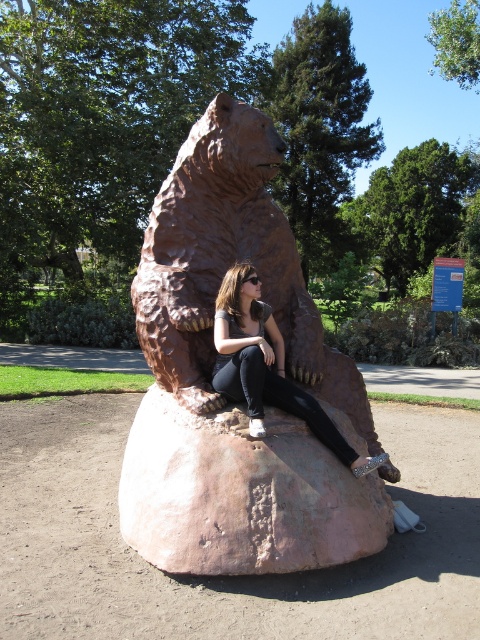
Based on the photo, you are a photographer trying to capture a clear shot of the matte bronze bear at center without the pink stone boulder at center blocking it. Based on their positions, is this possible?

The pink stone boulder at center is in front of the matte bronze bear at center, so it is blocking the view. To capture a clear shot of the matte bronze bear at center without the boulder, you would need to move around to a different angle where the boulder is not in front.

Consider the image. You are standing in a park and see the brown stone bear at center. If you take a step forward, will you be closer than 8 feet to the bear?

The brown stone bear at center is 8.74 feet away from viewer. If you take a step forward, you will be closer than 8 feet to the bear.

You are a photographer trying to capture a photo of the brown stone bear at center and the pink stone boulder at center. Which object is placed above the other in the image?

The brown stone bear at center is positioned over the pink stone boulder at center, so the bear is above the boulder.